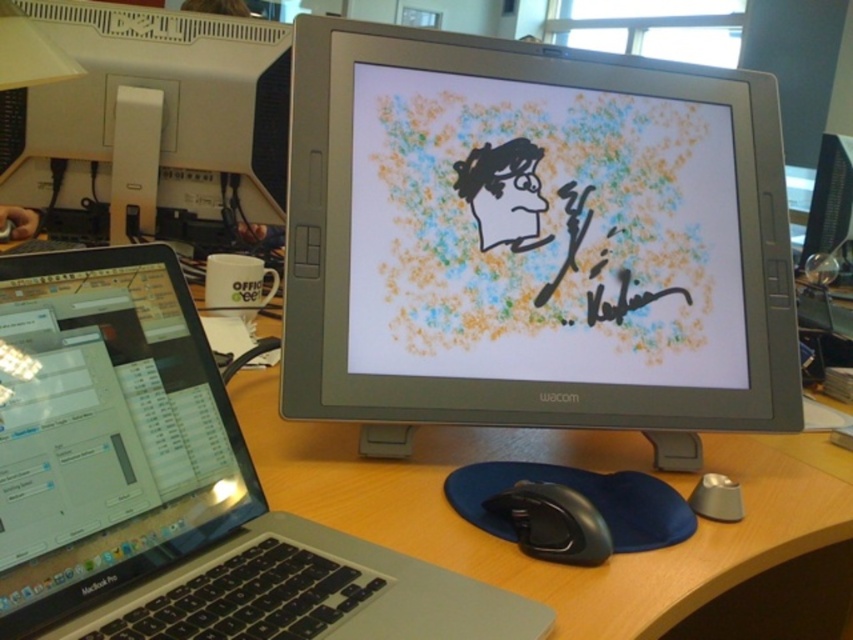
Can you confirm if satin black monitor at upper left is shorter than black rubberized mouse at lower center?

No.

Does satin black monitor at upper left come in front of black rubberized mouse at lower center?

No, it is not.

This screenshot has height=640, width=853. Describe the element at coordinates (152, 120) in the screenshot. I see `satin black monitor at upper left` at that location.

Where is `satin black monitor at upper left`? satin black monitor at upper left is located at coordinates (152, 120).

Between sleek silver laptop at left and satin black monitor at upper left, which one is positioned lower?

sleek silver laptop at left

Who is more forward, (51, 294) or (97, 44)?

Point (51, 294)

Image resolution: width=853 pixels, height=640 pixels. What are the coordinates of `sleek silver laptop at left` in the screenshot? It's located at (173, 486).

This screenshot has width=853, height=640. In order to click on slate gray monitor at center in this screenshot , I will do [532, 241].

Does point (653, 433) come closer to viewer compared to point (254, 74)?

Yes, point (653, 433) is in front of point (254, 74).

Does point (408, 362) lie behind point (77, 202)?

No, (408, 362) is closer to viewer.

Locate an element on the screen. This screenshot has height=640, width=853. slate gray monitor at center is located at coordinates (532, 241).